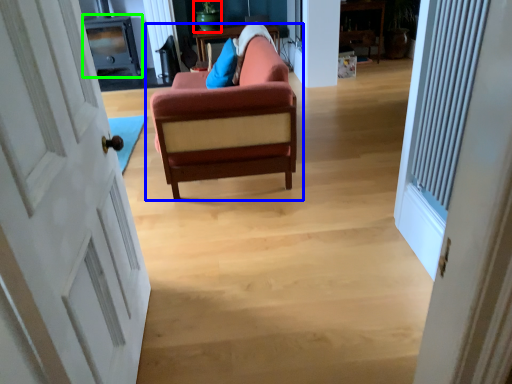
Question: Which is nearer to the teal (highlighted by a red box)? studio couch (highlighted by a blue box) or entertainment center (highlighted by a green box).

Choices:
 (A) studio couch
 (B) entertainment center

Answer: (B)